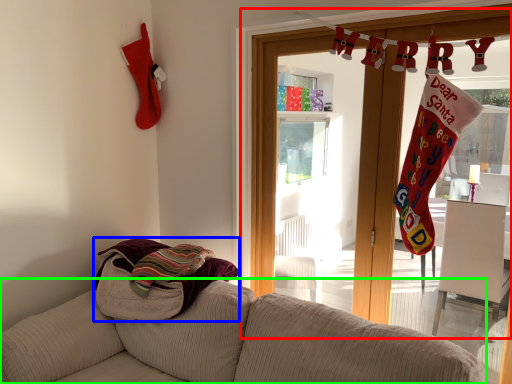
Question: Estimate the real-world distances between objects in this image. Which object is farther from window frame (highlighted by a red box), beach towel (highlighted by a blue box) or studio couch (highlighted by a green box)?

Choices:
 (A) beach towel
 (B) studio couch

Answer: (B)